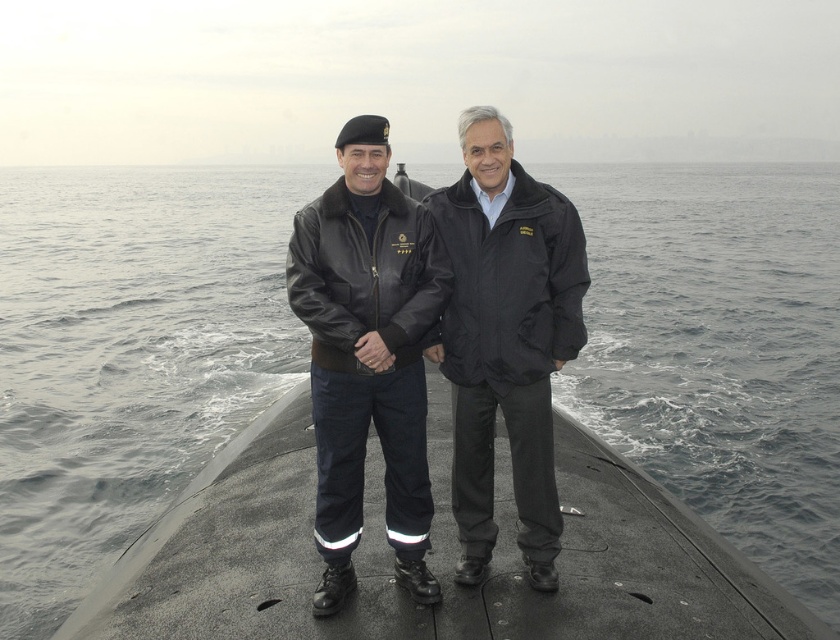
Based on the photo, you are a submarine crew member standing on the deck and want to check the water level. Where is the gray water at center located in the image?

The gray water at center is located at the 2D coordinates point (129,353) in the image.

Looking at this image, you are a submarine crew member trying to locate the emergency exit. You see the gray water at center and the matte black jacket at center. Which object is closer to the right side of the submarine deck?

The gray water at center is closer to the right side of the submarine deck since it is positioned to the right of the matte black jacket at center.